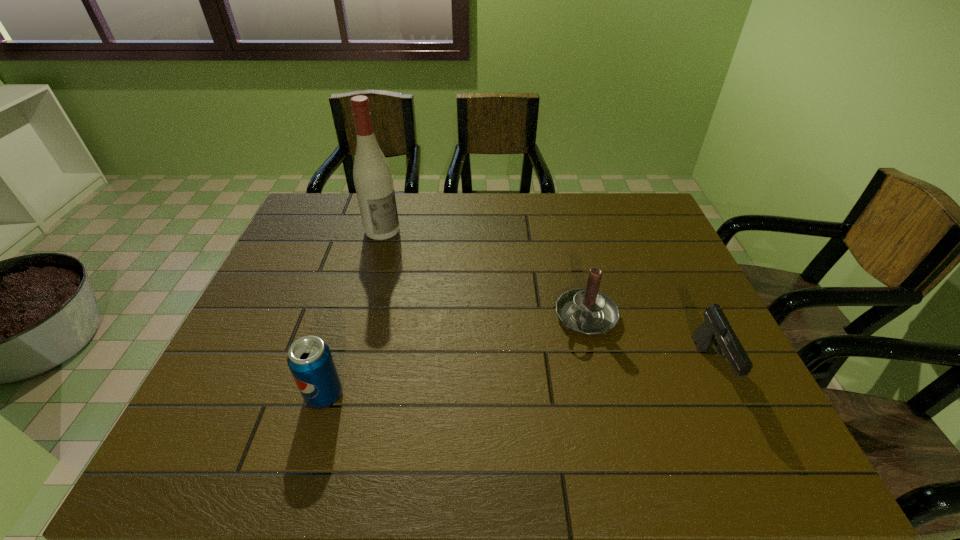
The height and width of the screenshot is (540, 960). I want to click on free spot on the desktop that is between the pop soda and the shortest object and is positioned on the side of the candle with the handle loop, so pos(509,381).

Locate an element on the screen. The image size is (960, 540). free space on the desktop that is between the pop soda and the shortest object and is positioned on the label of the tallest object is located at coordinates (543, 379).